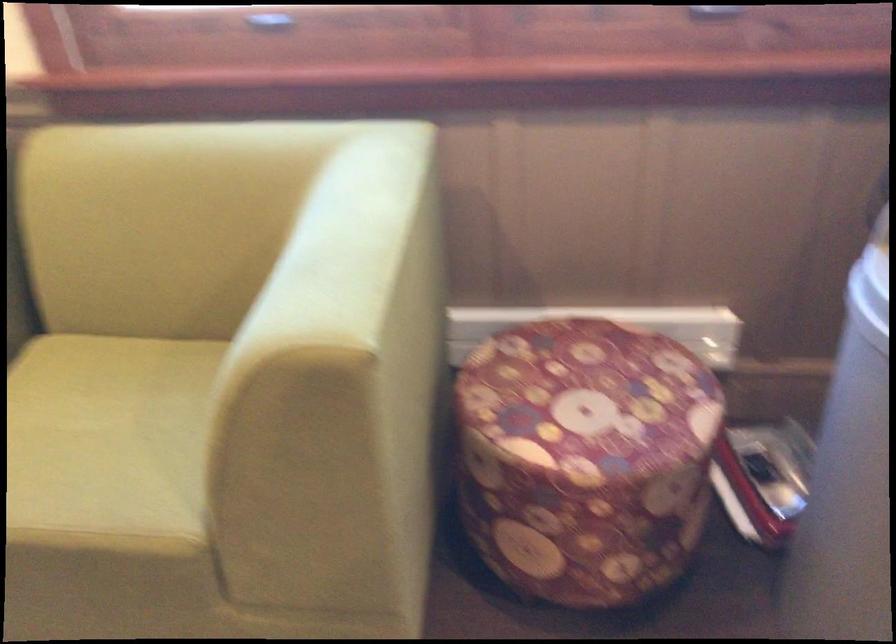
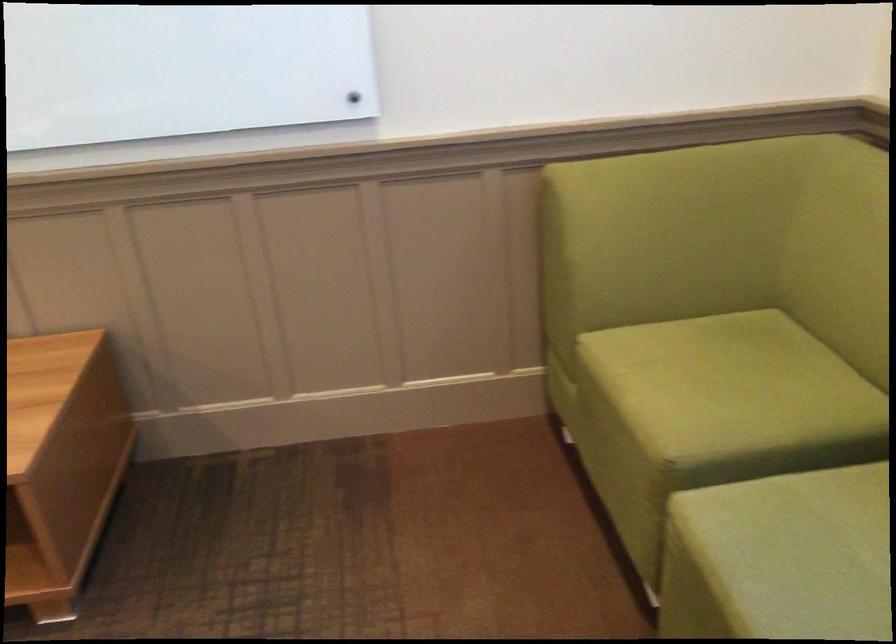
First-person continuous shooting, in which direction is the camera rotating?

The camera rotated toward left-down.